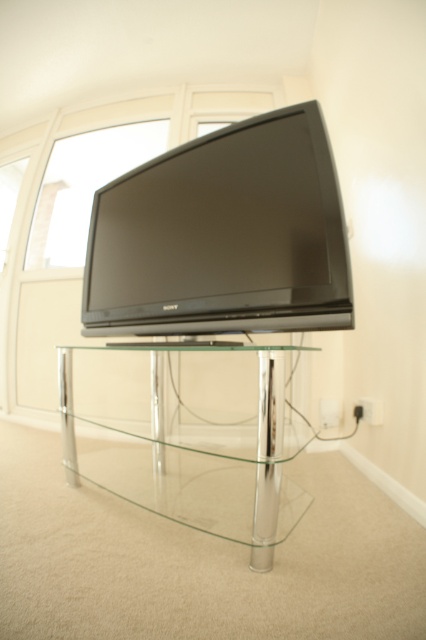
You are arranging a living room and want to place a tall floor lamp between the black glossy flat screen tv at center and the transparent glass table at center. Based on their heights, which object should the lamp be placed closer to?

The black glossy flat screen tv at center is much taller than the transparent glass table at center, so the lamp should be placed closer to the transparent glass table at center to ensure proper balance and visibility.

You are a delivery person who just arrived at the house. You need to place a heavy box on the surface that can support weight. Which object between the black glossy flat screen tv at center and the transparent glass table at center should you choose?

The transparent glass table at center is the appropriate surface to place the heavy box because the black glossy flat screen tv at center is located above it, indicating that the table is below and likely sturdy enough to support weight, whereas the TV itself is not meant for placing items on top.